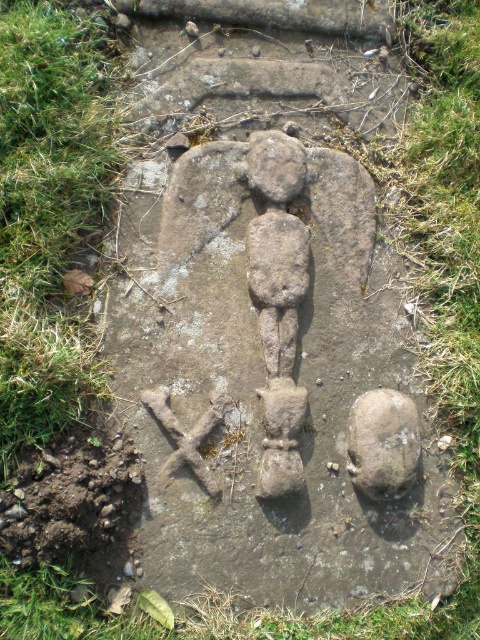
Question: Is rusty stone at lower right above rough stone head at center?

Choices:
 (A) no
 (B) yes

Answer: (A)

Question: Is green grass at lower left above rusty stone at lower right?

Choices:
 (A) no
 (B) yes

Answer: (B)

Question: Among these points, which one is nearest to the camera?

Choices:
 (A) (358, 426)
 (B) (84, 54)
 (C) (273, 195)

Answer: (B)

Question: Which point is farther from the camera taking this photo?

Choices:
 (A) (23, 342)
 (B) (412, 426)

Answer: (B)

Question: Can you confirm if green grass at lower left is bigger than rusty stone at lower right?

Choices:
 (A) no
 (B) yes

Answer: (B)

Question: Among these points, which one is nearest to the camera?

Choices:
 (A) (294, 138)
 (B) (356, 486)

Answer: (B)